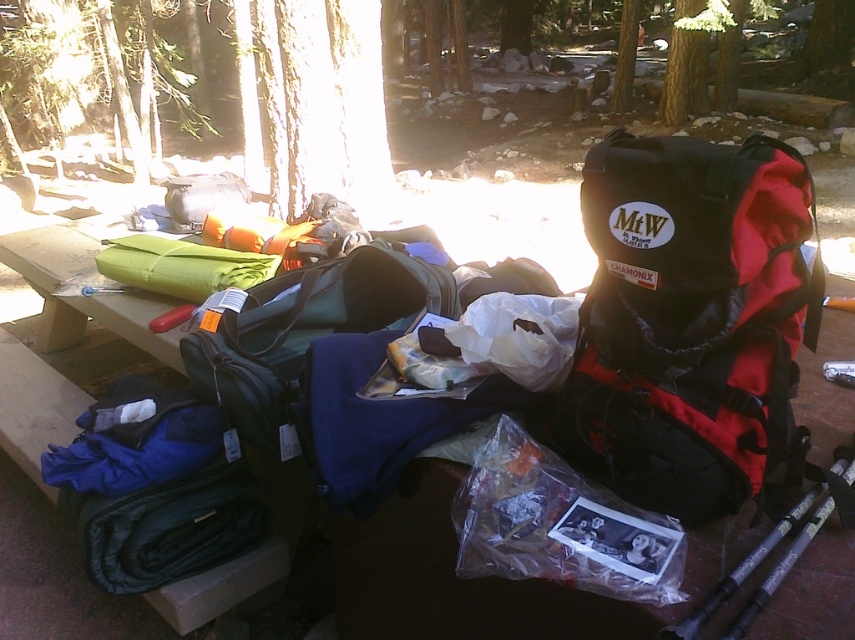
Question: Which of the following is the farthest from the observer?

Choices:
 (A) black/red nylon backpack at right
 (B) green fabric sleeping bag at center

Answer: (B)

Question: Which object is farther from the camera taking this photo?

Choices:
 (A) green fabric sleeping bag at center
 (B) black/red nylon backpack at right
 (C) translucent plastic bag at center
 (D) wooden picnic table at center

Answer: (A)

Question: Does black/red nylon backpack at right have a greater width compared to green fabric sleeping bag at center?

Choices:
 (A) no
 (B) yes

Answer: (A)

Question: Does wooden picnic table at center come behind translucent plastic bag at center?

Choices:
 (A) no
 (B) yes

Answer: (B)

Question: Which object is positioned farthest from the green fabric sleeping bag at center?

Choices:
 (A) wooden picnic table at center
 (B) black/red nylon backpack at right

Answer: (B)

Question: Can you confirm if black/red nylon backpack at right is positioned to the right of green fabric sleeping bag at center?

Choices:
 (A) no
 (B) yes

Answer: (B)